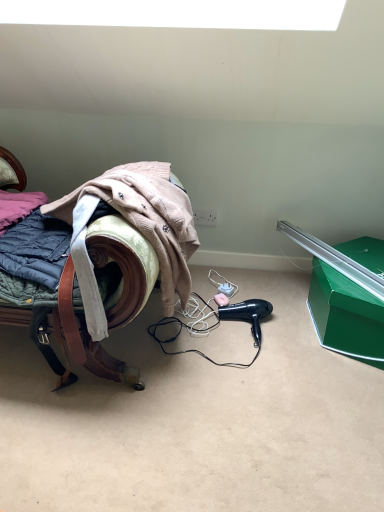
Locate an element on the screen. The image size is (384, 512). vacant area that is situated to the right of black plastic hair dryer at lower center is located at coordinates (301, 332).